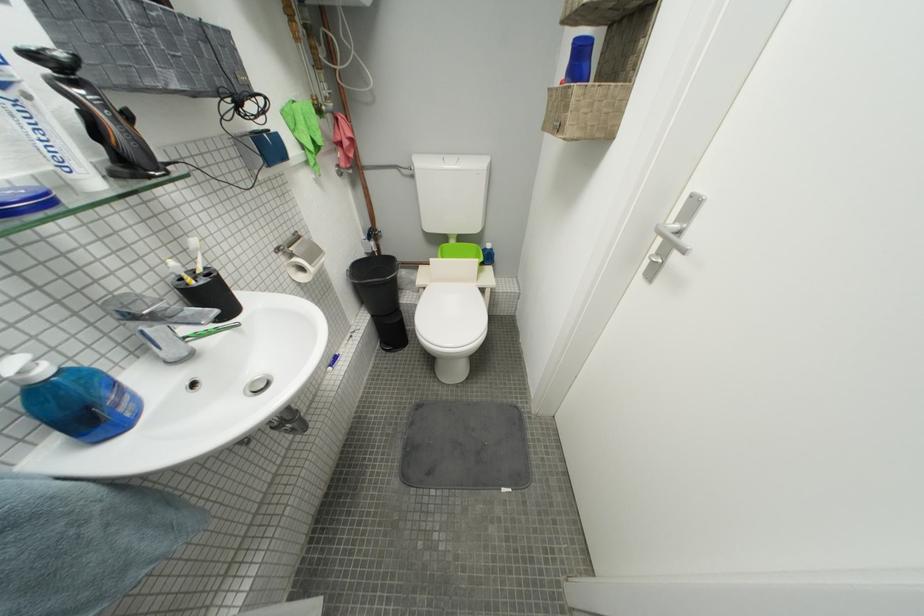
Find where to push the blue dispenser pump. Please return your answer as a coordinate pair (x, y).

(579, 60)